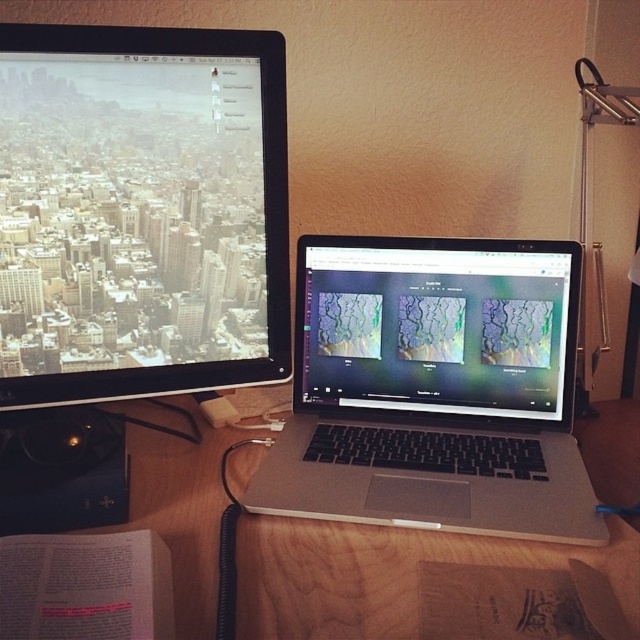
You are setting up a new webcam for video calls. The webcam has a field of view that best captures items within a 0.25 unit radius from the center of the desk. Given the position of the matte black monitor at upper left, will the webcam be able to capture it clearly?

The matte black monitor at upper left is located at point (141, 211). Since the webcam captures items within a 0.25 unit radius from the center, the distance from the center to the monitor would need to be calculated. If the coordinates are relative to the desk, the distance would be sqrt 0.330 squared plus 0.223 squared, which is approximately 0.4 units. This exceeds the 0.25 radius, so the webcam cannot capture the matte black monitor at upper left clearly.

You are holding a camera and want to take a photo of the point at coordinates (x=540, y=432). The camera is currently 34.79 inches away from that point. If the recommended distance for clear photos is 30 inches, should you move closer or farther away?

The point at coordinates (x=540, y=432) is 34.79 inches away from the camera. Since the recommended distance is 30 inches, you should move closer to reduce the distance to the desired range.